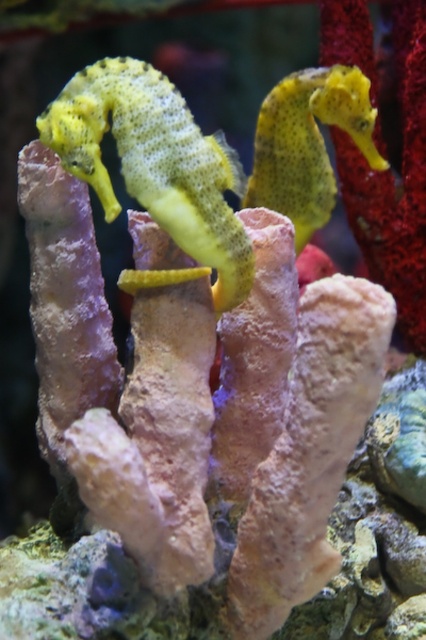
Can you confirm if yellow matte seahorse at center is taller than yellow textured seahorse at upper right?

Correct, yellow matte seahorse at center is much taller as yellow textured seahorse at upper right.

Does yellow matte seahorse at center appear over yellow textured seahorse at upper right?

Incorrect, yellow matte seahorse at center is not positioned above yellow textured seahorse at upper right.

Is point (195, 230) in front of point (308, 156)?

Yes, it is in front of point (308, 156).

Where is `yellow matte seahorse at center`? yellow matte seahorse at center is located at coordinates (155, 163).